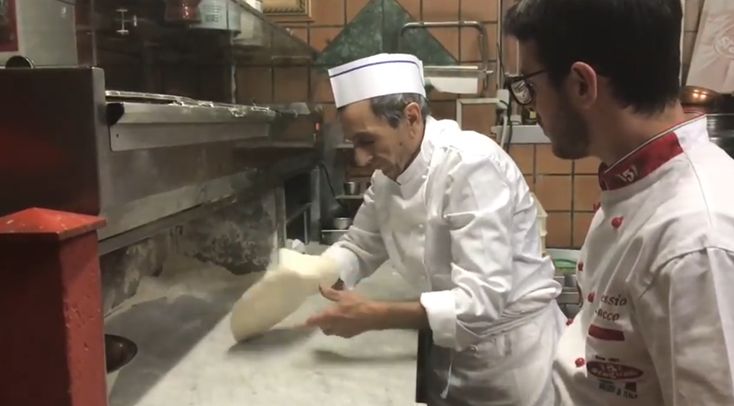
In order to click on food prep counter in this screenshot , I will do `click(310, 369)`.